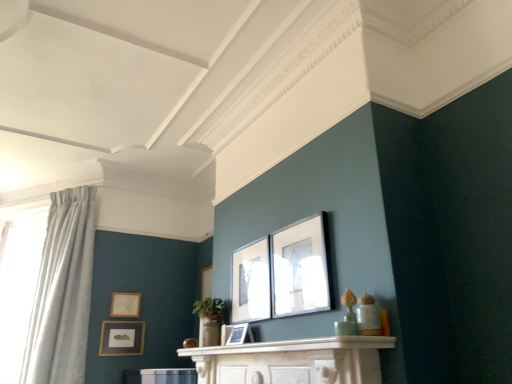
Question: Which direction should I rotate to look at matte black picture frame at center, which is the 4th picture frame in back-to-front order, — up or down?

Choices:
 (A) down
 (B) up

Answer: (A)

Question: Can matte gold picture frame at upper left, marked as the fifth picture frame in a front-to-back arrangement, be found inside white sheer curtain at left?

Choices:
 (A) no
 (B) yes

Answer: (A)

Question: From a real-world perspective, is white sheer curtain at left on top of matte gold picture frame at upper left, which appears as the 1th picture frame when viewed from the back?

Choices:
 (A) yes
 (B) no

Answer: (A)

Question: Is white sheer curtain at left at the right side of matte gold picture frame at upper left, marked as the fifth picture frame in a front-to-back arrangement?

Choices:
 (A) yes
 (B) no

Answer: (B)

Question: Is white sheer curtain at left looking in the opposite direction of matte gold picture frame at upper left, which is the fifth picture frame from right to left?

Choices:
 (A) yes
 (B) no

Answer: (B)

Question: Considering the relative sizes of white sheer curtain at left and matte gold picture frame at upper left, which is the fifth picture frame from right to left, in the image provided, is white sheer curtain at left wider than matte gold picture frame at upper left, which is the fifth picture frame from right to left,?

Choices:
 (A) yes
 (B) no

Answer: (A)

Question: Is white sheer curtain at left in front of matte gold picture frame at upper left, marked as the fifth picture frame in a front-to-back arrangement?

Choices:
 (A) yes
 (B) no

Answer: (A)

Question: Considering the relative sizes of matte gold picture frame at upper left, which is the fifth picture frame from right to left, and white marble mantle at center in the image provided, is matte gold picture frame at upper left, which is the fifth picture frame from right to left, taller than white marble mantle at center?

Choices:
 (A) yes
 (B) no

Answer: (A)

Question: Can you confirm if matte gold picture frame at upper left, which appears as the 1th picture frame when viewed from the back, is smaller than white marble mantle at center?

Choices:
 (A) yes
 (B) no

Answer: (A)

Question: Does matte gold picture frame at upper left, which appears as the 1th picture frame when viewed from the back, appear on the right side of white marble mantle at center?

Choices:
 (A) no
 (B) yes

Answer: (A)

Question: Could you tell me if matte gold picture frame at upper left, marked as the fifth picture frame in a front-to-back arrangement, is turned towards white marble mantle at center?

Choices:
 (A) yes
 (B) no

Answer: (A)

Question: Does matte gold picture frame at upper left, marked as the fifth picture frame in a front-to-back arrangement, have a lesser width compared to white marble mantle at center?

Choices:
 (A) no
 (B) yes

Answer: (B)

Question: Is white marble mantle at center at the back of matte gold picture frame at upper left, which is the fifth picture frame from right to left?

Choices:
 (A) yes
 (B) no

Answer: (B)

Question: From a real-world perspective, is matte black picture frame at upper center, positioned as the first picture frame in front-to-back order, physically above matte black picture frame at lower left, the 2th picture frame when ordered from back to front?

Choices:
 (A) yes
 (B) no

Answer: (A)